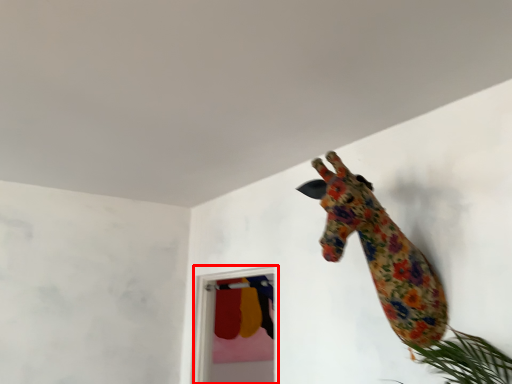
Question: Considering the relative positions of glass door (annotated by the red box) and giraffe in the image provided, where is glass door (annotated by the red box) located with respect to the staircase?

Choices:
 (A) right
 (B) left

Answer: (B)